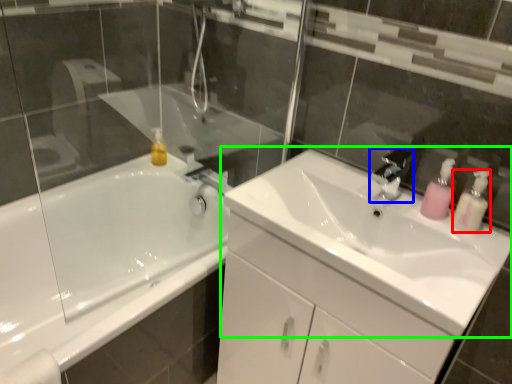
Question: Which object is positioned farthest from soap dispenser (highlighted by a red box)? Select from tap (highlighted by a blue box) and sink (highlighted by a green box).

Choices:
 (A) tap
 (B) sink

Answer: (B)